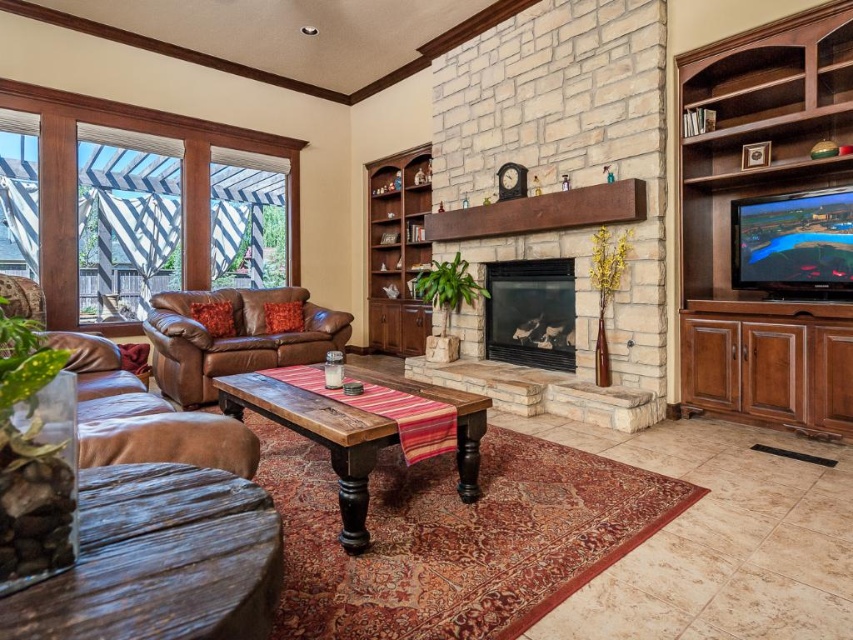
You are planning to place a 1.8 meter tall floor lamp in the living room. Considering the space near the brown leather couch at lower left and the brown leather armchair at left, which piece of furniture would allow the lamp to stand without blocking the view of the fireplace?

The brown leather armchair at left is taller than the brown leather couch at lower left. Since the lamp is 1.8 meters tall, placing it next to the taller brown leather armchair at left would ensure it doesn not block the view of the fireplace as the armchair can provide a better backdrop without obstruction.

You are a delivery person carrying a large package that is 1.5 meters wide. You need to place it between the brown leather couch at lower left and the brown leather armchair at left. Is there enough space for the package to fit between them?

The brown leather couch at lower left and the brown leather armchair at left are 1.49 meters apart from each other. Since the package is 1.5 meters wide, it is slightly wider than the available space. Therefore, the package cannot fit between them.